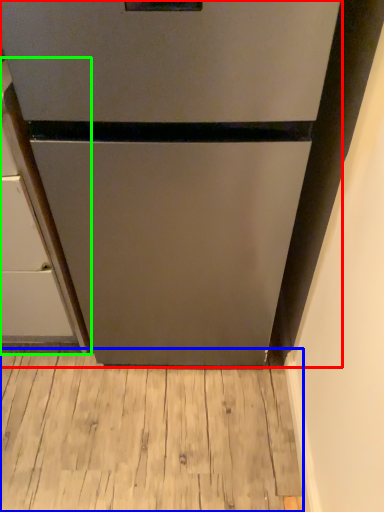
Question: Estimate the real-world distances between objects in this image. Which object is farther from refrigerator (highlighted by a red box), hardwood (highlighted by a blue box) or cabinetry (highlighted by a green box)?

Choices:
 (A) hardwood
 (B) cabinetry

Answer: (A)